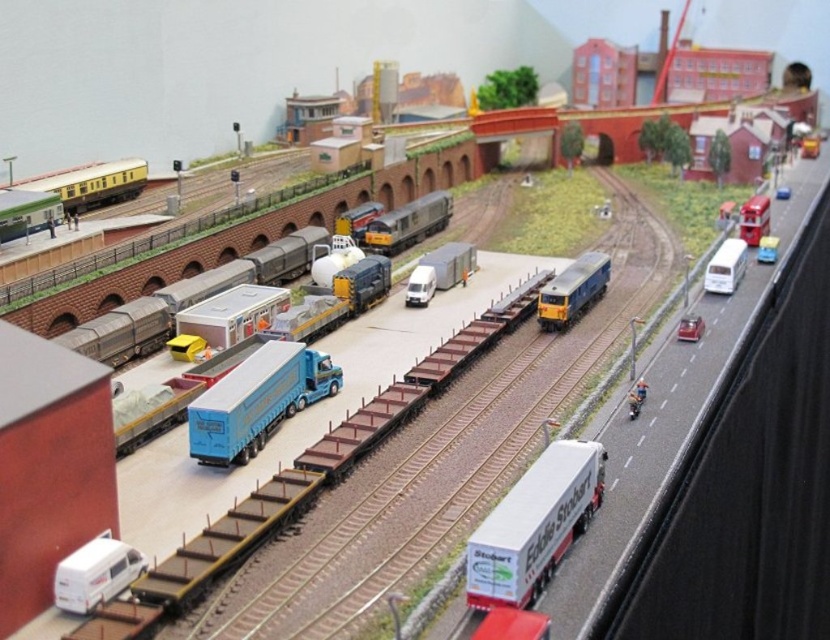
Question: Which of the following is the farthest from the observer?

Choices:
 (A) (x=694, y=323)
 (B) (x=564, y=500)
 (C) (x=276, y=346)
 (D) (x=769, y=227)

Answer: (D)

Question: Is metal freight train at center thinner than metallic blue train at right?

Choices:
 (A) no
 (B) yes

Answer: (A)

Question: Which object is farther from the camera taking this photo?

Choices:
 (A) metal freight train at center
 (B) blue metallic truck at center-left
 (C) shiny red car at right

Answer: (C)

Question: Is metal freight train at center closer to the viewer compared to white matte truck at center?

Choices:
 (A) yes
 (B) no

Answer: (A)

Question: Which of the following is the closest to the observer?

Choices:
 (A) metallic blue train at right
 (B) white matte truck at center

Answer: (B)

Question: Does blue metallic truck at center-left have a greater width compared to white glossy van at upper right?

Choices:
 (A) yes
 (B) no

Answer: (A)